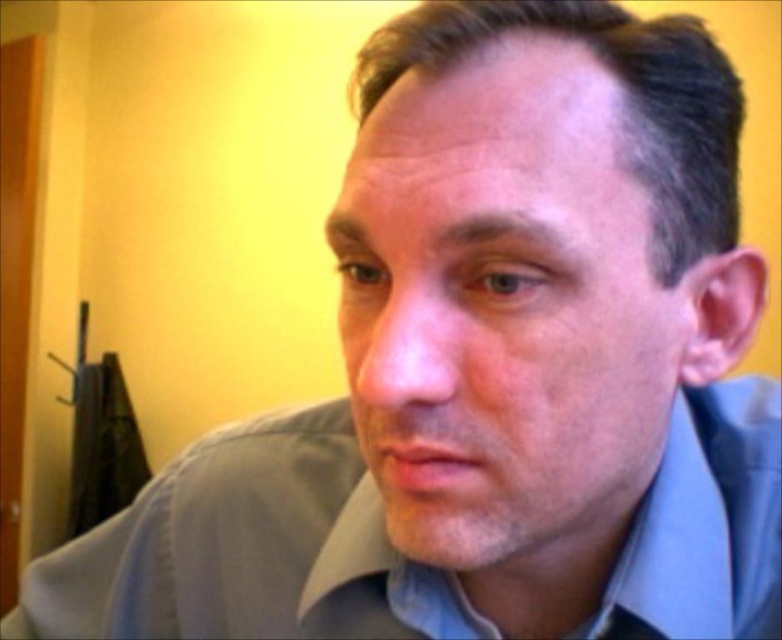
Is smooth skin face at center thinner than light blue cotton dress shirt at center?

Correct, smooth skin face at center's width is less than light blue cotton dress shirt at center's.

Who is positioned more to the right, smooth skin face at center or light blue cotton dress shirt at center?

Positioned to the right is smooth skin face at center.

The image size is (782, 640). Describe the element at coordinates (504, 310) in the screenshot. I see `smooth skin face at center` at that location.

Where is `smooth skin face at center`? The image size is (782, 640). smooth skin face at center is located at coordinates (504, 310).